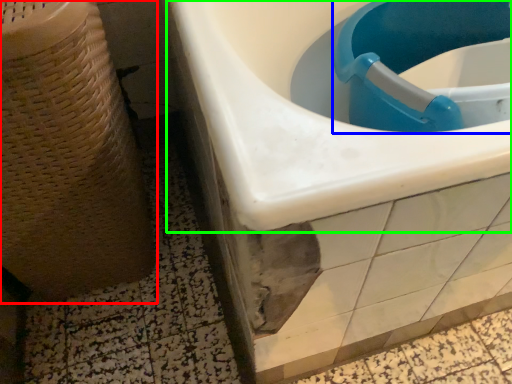
Question: Estimate the real-world distances between objects in this image. Which object is closer to potty (highlighted by a red box), sink (highlighted by a blue box) or sink (highlighted by a green box)?

Choices:
 (A) sink
 (B) sink

Answer: (B)